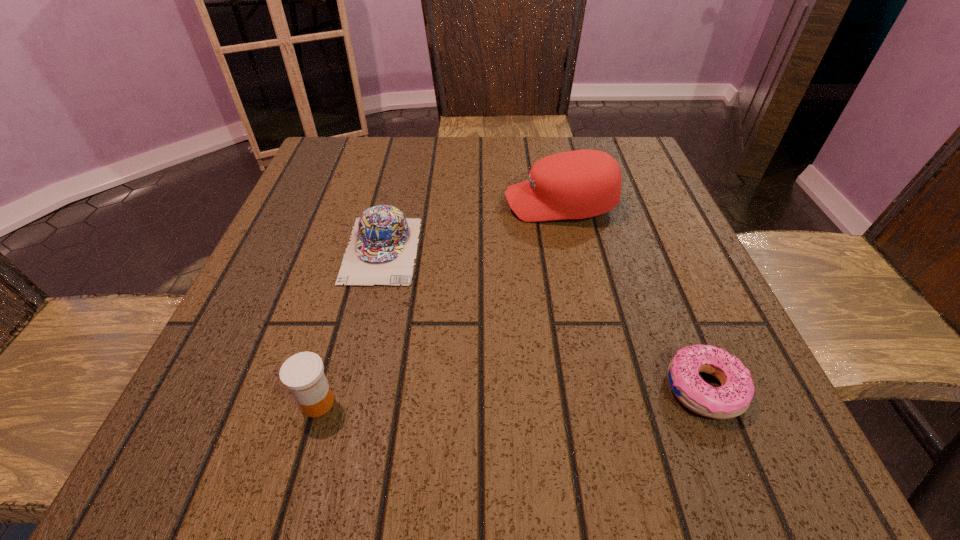
Where is `the tallest object`? the tallest object is located at coordinates (579, 184).

Locate an element on the screen. Image resolution: width=960 pixels, height=540 pixels. the taller cap is located at coordinates (579, 184).

The image size is (960, 540). In order to click on the third shortest object in this screenshot , I will do `click(303, 373)`.

This screenshot has height=540, width=960. Find the location of `the left cap`. the left cap is located at coordinates (382, 249).

Locate an element on the screen. The width and height of the screenshot is (960, 540). the second shortest object is located at coordinates (382, 249).

I want to click on the shortest object, so click(733, 398).

Image resolution: width=960 pixels, height=540 pixels. What are the coordinates of `vacant space located 0.270m on the front-facing side of the taller cap` in the screenshot? It's located at (375, 204).

Image resolution: width=960 pixels, height=540 pixels. Find the location of `vacant space located 0.210m on the front-facing side of the taller cap`. vacant space located 0.210m on the front-facing side of the taller cap is located at coordinates (404, 204).

I want to click on vacant space located 0.080m on the front-facing side of the taller cap, so click(466, 204).

Image resolution: width=960 pixels, height=540 pixels. I want to click on vacant space located 0.390m on the label of the medicine, so click(x=622, y=403).